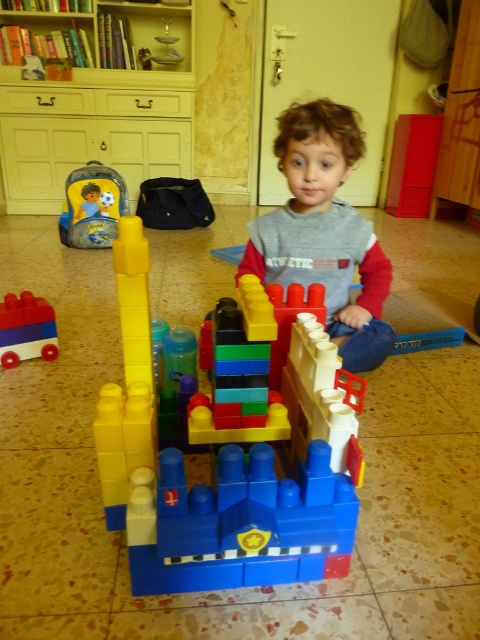
Question: Which object is closer to the camera taking this photo?

Choices:
 (A) gray fabric backpack at left
 (B) matte gray sweater at center
 (C) yellow wood bookshelf at upper left
 (D) blue plastic car at center

Answer: (B)

Question: Is matte gray sweater at center above gray fabric backpack at left?

Choices:
 (A) yes
 (B) no

Answer: (B)

Question: Which of these objects is positioned closest to the blue plastic car at center?

Choices:
 (A) yellow wood bookshelf at upper left
 (B) brick-like plastic castle at center

Answer: (B)

Question: Which object is the closest to the blue plastic car at center?

Choices:
 (A) matte gray sweater at center
 (B) brick-like plastic castle at center

Answer: (A)

Question: Is brick-like plastic castle at center smaller than yellow wood bookshelf at upper left?

Choices:
 (A) yes
 (B) no

Answer: (A)

Question: Is brick-like plastic castle at center in front of blue plastic car at center?

Choices:
 (A) yes
 (B) no

Answer: (A)